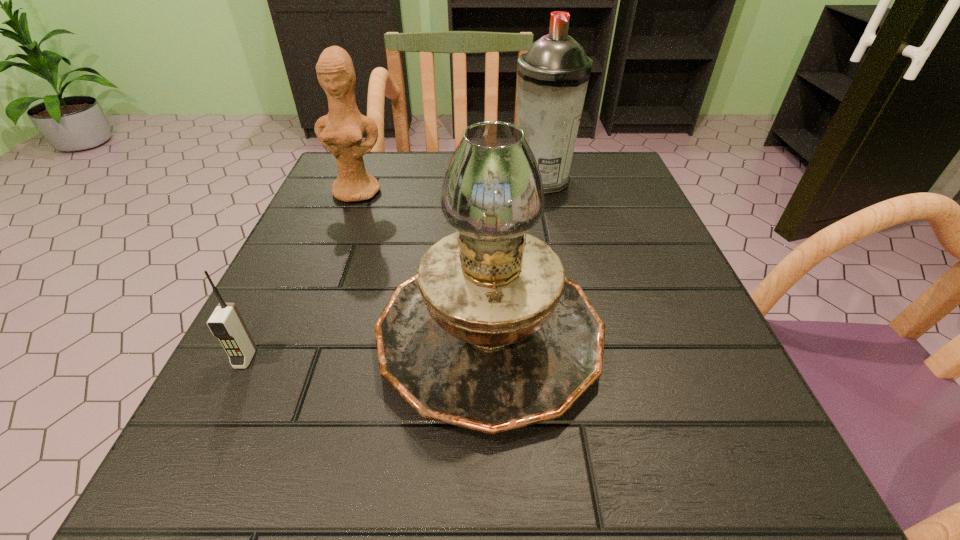
The height and width of the screenshot is (540, 960). In order to click on object situated at the near edge in this screenshot , I will do `click(490, 335)`.

Find the location of a particular element. The height and width of the screenshot is (540, 960). figurine that is at the left edge is located at coordinates (340, 131).

The width and height of the screenshot is (960, 540). In order to click on cellular telephone at the left edge in this screenshot , I will do `click(226, 323)`.

Locate an element on the screen. This screenshot has height=540, width=960. object situated at the right edge is located at coordinates click(x=553, y=75).

You are a GUI agent. You are given a task and a screenshot of the screen. Output one action in this format:
    pyautogui.click(x=<x>, y=<y>)
    Task: Click on the object that is at the far left corner
    The image size is (960, 540).
    Given the screenshot: What is the action you would take?
    pyautogui.click(x=340, y=131)

You are a GUI agent. You are given a task and a screenshot of the screen. Output one action in this format:
    pyautogui.click(x=<x>, y=<y>)
    Task: Click on the object at the far right corner
    This screenshot has height=540, width=960.
    Given the screenshot: What is the action you would take?
    (553, 75)

At what (x,y) coordinates should I click in order to perform the action: click on free space at the near edge of the desktop. Please return your answer as a coordinate pair (x, y). The width and height of the screenshot is (960, 540). Looking at the image, I should click on (433, 500).

Where is `vacant space at the right edge of the desktop`? This screenshot has height=540, width=960. vacant space at the right edge of the desktop is located at coordinates (633, 289).

Where is `free space at the far left corner of the desktop`? free space at the far left corner of the desktop is located at coordinates (329, 176).

This screenshot has height=540, width=960. What are the coordinates of `free region at the near left corner` in the screenshot? It's located at (277, 512).